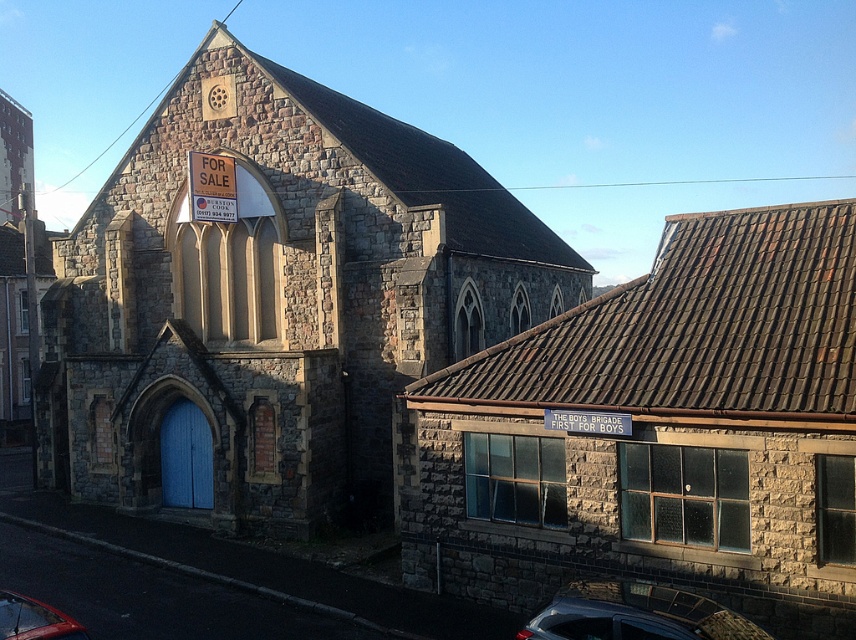
In the scene shown: Between stone textured chapel at center and silver metallic car at lower right, which one appears on the right side from the viewer's perspective?

From the viewer's perspective, silver metallic car at lower right appears more on the right side.

Which is above, stone textured chapel at center or silver metallic car at lower right?

stone textured chapel at center is above.

I want to click on stone textured chapel at center, so click(274, 301).

The height and width of the screenshot is (640, 856). Find the location of `stone textured chapel at center`. stone textured chapel at center is located at coordinates (274, 301).

This screenshot has width=856, height=640. What are the coordinates of `silver metallic car at lower right` in the screenshot? It's located at (635, 614).

Can you confirm if silver metallic car at lower right is smaller than shiny red car at lower left?

Incorrect, silver metallic car at lower right is not smaller in size than shiny red car at lower left.

Is point (710, 630) positioned after point (12, 609)?

No, it is in front of (12, 609).

You are a GUI agent. You are given a task and a screenshot of the screen. Output one action in this format:
    pyautogui.click(x=<x>, y=<y>)
    Task: Click on the silver metallic car at lower right
    Image resolution: width=856 pixels, height=640 pixels.
    Given the screenshot: What is the action you would take?
    pyautogui.click(x=635, y=614)

Between stone textured chapel at center and stone tiled roof at upper right, which one has less height?

stone tiled roof at upper right

The height and width of the screenshot is (640, 856). Find the location of `stone textured chapel at center`. stone textured chapel at center is located at coordinates (274, 301).